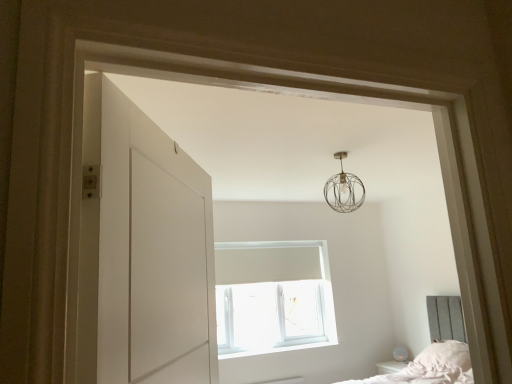
This screenshot has height=384, width=512. What are the coordinates of `metallic wire sphere at upper center` in the screenshot? It's located at (344, 189).

Identify the location of white painted wood at lower center. The image size is (512, 384). (280, 347).

Considering the relative sizes of white plastic window at center and metallic wire sphere at upper center in the image provided, is white plastic window at center wider than metallic wire sphere at upper center?

No.

From their relative heights in the image, would you say white plastic window at center is taller or shorter than metallic wire sphere at upper center?

Considering their sizes, white plastic window at center has more height than metallic wire sphere at upper center.

In the scene shown: Which object is further away from the camera taking this photo, white plastic window at center or metallic wire sphere at upper center?

Positioned behind is white plastic window at center.

You are a GUI agent. You are given a task and a screenshot of the screen. Output one action in this format:
    pyautogui.click(x=<x>, y=<y>)
    Task: Click on the lamp that is in front of the white plastic window at center
    The image size is (512, 384).
    Given the screenshot: What is the action you would take?
    click(344, 189)

Is white plastic window at center positioned far away from white painted wood at lower center?

That's not correct — white plastic window at center is a little close to white painted wood at lower center.

From a real-world perspective, does white plastic window at center sit lower than white painted wood at lower center?

Actually, white plastic window at center is physically above white painted wood at lower center in the real world.

Identify the location of window sill that is under the white plastic window at center (from a real-world perspective). (280, 347).

Relative to white painted wood at lower center, is white plastic window at center in front or behind?

white plastic window at center is behind white painted wood at lower center.

Is white painted wood at lower center completely or partially outside of white plastic window at center?

That's correct, white painted wood at lower center is outside of white plastic window at center.

Which object is closer to the camera, white painted wood at lower center or white plastic window at center?

white painted wood at lower center is closer to the camera.

Who is bigger, white painted wood at lower center or white plastic window at center?

With larger size is white plastic window at center.

Who is bigger, metallic wire sphere at upper center or white painted wood at lower center?

metallic wire sphere at upper center.

From a real-world perspective, is metallic wire sphere at upper center located beneath white painted wood at lower center?

No, from a real-world perspective, metallic wire sphere at upper center is not beneath white painted wood at lower center.

From the picture: Considering their positions, is metallic wire sphere at upper center located in front of or behind white painted wood at lower center?

Visually, metallic wire sphere at upper center is located in front of white painted wood at lower center.

How much distance is there between metallic wire sphere at upper center and white painted wood at lower center?

metallic wire sphere at upper center is 1.81 meters from white painted wood at lower center.

From the image's perspective, is white painted wood at lower center located above metallic wire sphere at upper center?

No.

Is white painted wood at lower center outside of metallic wire sphere at upper center?

white painted wood at lower center is positioned outside metallic wire sphere at upper center.

Can you confirm if white painted wood at lower center is wider than metallic wire sphere at upper center?

No, white painted wood at lower center is not wider than metallic wire sphere at upper center.

What are the coordinates of `lamp lying on the right of white plastic window at center` in the screenshot? It's located at (344, 189).

From a real-world perspective, is metallic wire sphere at upper center located beneath white plastic window at center?

No, from a real-world perspective, metallic wire sphere at upper center is not beneath white plastic window at center.

Considering the relative sizes of metallic wire sphere at upper center and white plastic window at center in the image provided, is metallic wire sphere at upper center bigger than white plastic window at center?

No.

How different are the orientations of metallic wire sphere at upper center and white plastic window at center in degrees?

They differ by 89.2 degrees in their facing directions.

You are a GUI agent. You are given a task and a screenshot of the screen. Output one action in this format:
    pyautogui.click(x=<x>, y=<y>)
    Task: Click on the window on the left of metallic wire sphere at upper center
    The image size is (512, 384).
    Given the screenshot: What is the action you would take?
    pyautogui.click(x=273, y=297)

Locate an element on the screen. This screenshot has height=384, width=512. window sill below the white plastic window at center (from a real-world perspective) is located at coordinates (280, 347).

From the image, which object appears to be nearer to metallic wire sphere at upper center, white plastic window at center or white painted wood at lower center?

white plastic window at center lies closer to metallic wire sphere at upper center than the other object.

Looking at the image, which one is located closer to metallic wire sphere at upper center, white painted wood at lower center or white plastic window at center?

Among the two, white plastic window at center is located nearer to metallic wire sphere at upper center.

Looking at this image, considering their positions, is white plastic window at center positioned closer to white painted wood at lower center than metallic wire sphere at upper center?

Based on the image, white plastic window at center appears to be nearer to white painted wood at lower center.

Based on the photo, looking at the image, which one is located further to white plastic window at center, metallic wire sphere at upper center or white painted wood at lower center?

The object further to white plastic window at center is metallic wire sphere at upper center.

Based on their spatial positions, is metallic wire sphere at upper center or white plastic window at center further from white painted wood at lower center?

metallic wire sphere at upper center.

Looking at this image, considering their positions, is white painted wood at lower center positioned closer to white plastic window at center than metallic wire sphere at upper center?

white painted wood at lower center is closer to white plastic window at center.

This screenshot has height=384, width=512. Find the location of `window between metallic wire sphere at upper center and white painted wood at lower center vertically`. window between metallic wire sphere at upper center and white painted wood at lower center vertically is located at coordinates (273, 297).